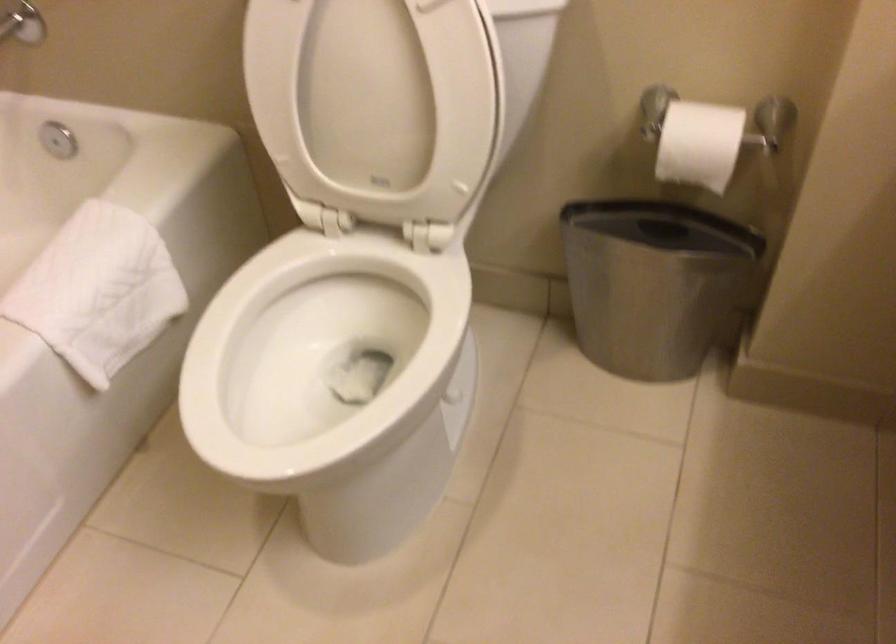
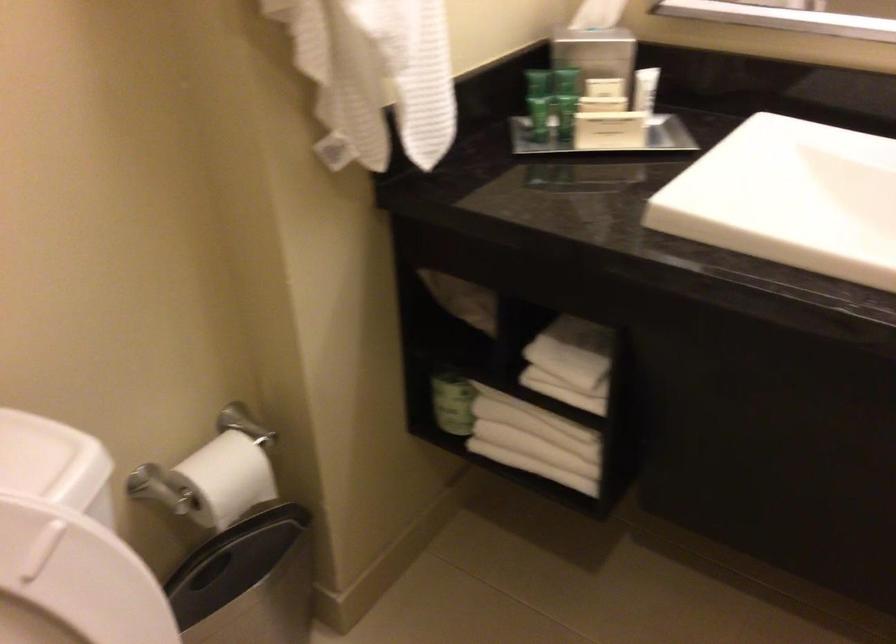
The point at (x=686, y=270) is marked in the first image. Where is the corresponding point in the second image?

(247, 582)